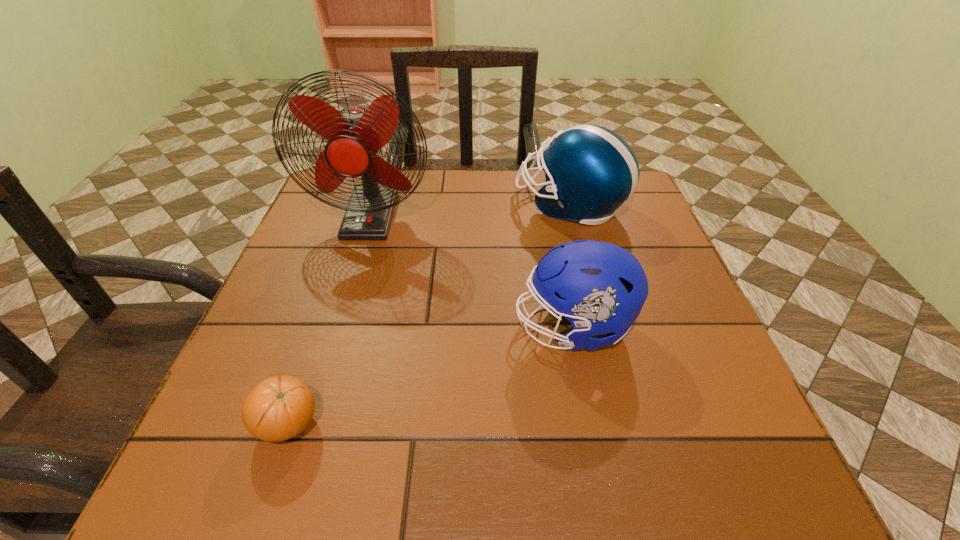
Locate an element on the screen. object that is at the far right corner is located at coordinates (590, 171).

This screenshot has height=540, width=960. In the image, there is a desktop. In order to click on vacant space at the far edge in this screenshot , I will do `click(421, 181)`.

In the image, there is a desktop. Where is `free space at the near edge`? This screenshot has width=960, height=540. free space at the near edge is located at coordinates (451, 440).

At what (x,y) coordinates should I click in order to perform the action: click on vacant space at the left edge of the desktop. Please return your answer as a coordinate pair (x, y). The width and height of the screenshot is (960, 540). Looking at the image, I should click on (351, 278).

Find the location of a particular element. vacant space at the right edge is located at coordinates (634, 222).

This screenshot has height=540, width=960. I want to click on free area in between the farther football helmet and the fan, so click(x=470, y=210).

What are the coordinates of `vacant area that lies between the farther football helmet and the fan` in the screenshot? It's located at (470, 210).

This screenshot has height=540, width=960. I want to click on vacant point located between the shortest object and the farther football helmet, so click(x=429, y=314).

Where is `free space that is in between the farther football helmet and the nearest object`? The width and height of the screenshot is (960, 540). free space that is in between the farther football helmet and the nearest object is located at coordinates pyautogui.click(x=429, y=314).

You are a GUI agent. You are given a task and a screenshot of the screen. Output one action in this format:
    pyautogui.click(x=<x>, y=<y>)
    Task: Click on the free space between the tallest object and the farther football helmet
    The image size is (960, 540).
    Given the screenshot: What is the action you would take?
    pyautogui.click(x=470, y=210)